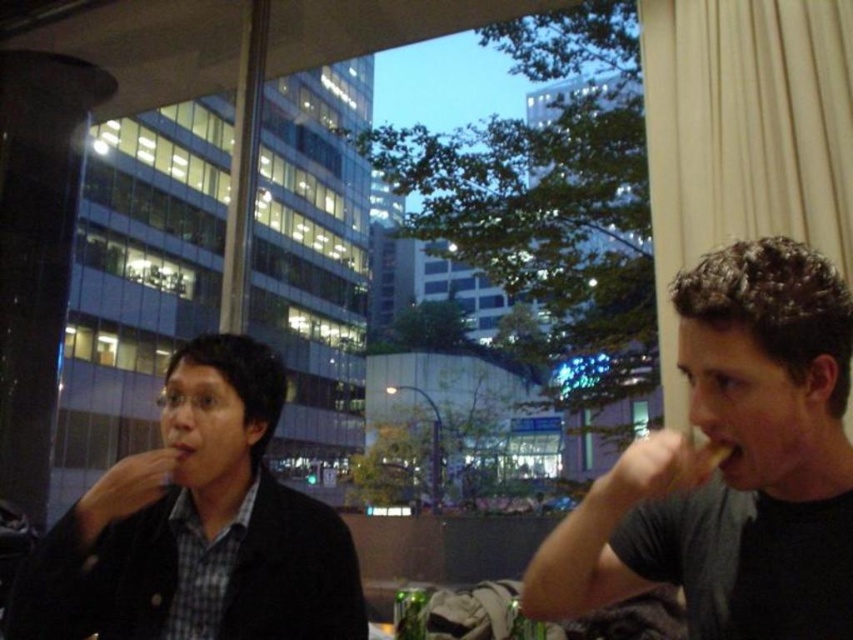
You are a waiter in a restaurant and need to serve two customers seated at a table. The customers are wearing the black matte shirt at right and the matte black jacket at left. If you approach the table from the front, which customer is on your right?

The black matte shirt at right is positioned on the right side of the matte black jacket at left, so the customer wearing the black matte shirt at right would be on your right when approaching from the front.